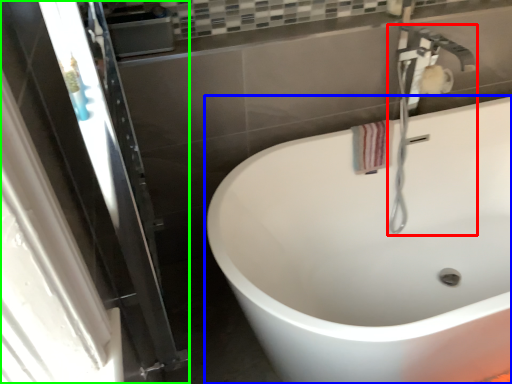
Question: Which object is the farthest from plumbing fixture (highlighted by a red box)? Choose among these: bathtub (highlighted by a blue box) or screen door (highlighted by a green box).

Choices:
 (A) bathtub
 (B) screen door

Answer: (B)